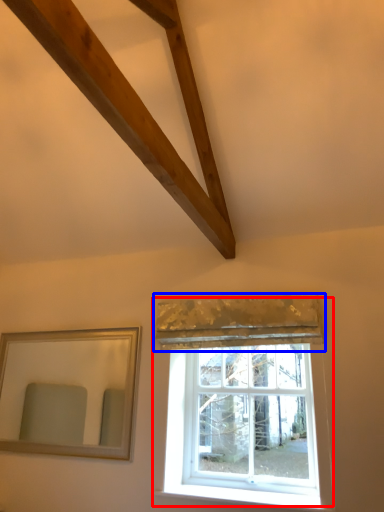
Question: Which object is closer to the camera taking this photo, window (highlighted by a red box) or curtain (highlighted by a blue box)?

Choices:
 (A) window
 (B) curtain

Answer: (B)